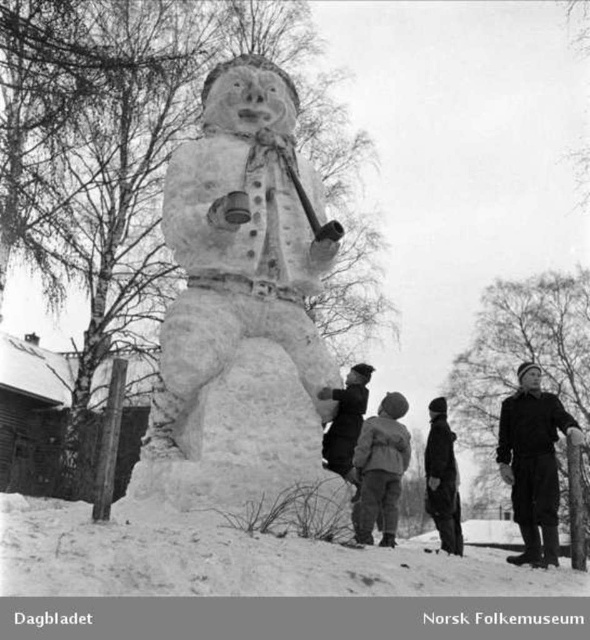
Can you confirm if dark gray woolen hat at upper right is bigger than dark woolen coat at center?

Incorrect, dark gray woolen hat at upper right is not larger than dark woolen coat at center.

In the scene shown: Does dark gray woolen hat at upper right have a lesser height compared to dark woolen coat at center?

Yes.

This screenshot has height=640, width=590. What do you see at coordinates (533, 464) in the screenshot?
I see `dark gray woolen hat at upper right` at bounding box center [533, 464].

Where is `dark gray woolen hat at upper right`? This screenshot has height=640, width=590. dark gray woolen hat at upper right is located at coordinates (533, 464).

Which is above, white snowman at center or dark woolen coat at center?

Positioned higher is white snowman at center.

Between white snowman at center and dark woolen coat at center, which one has less height?

Standing shorter between the two is white snowman at center.

Between point (278, 344) and point (447, 552), which one is positioned behind?

The point (447, 552) is behind.

Locate an element on the screen. white snowman at center is located at coordinates (240, 301).

Can you confirm if light gray woolen jacket at center is taller than dark woolen coat at center?

No, light gray woolen jacket at center is not taller than dark woolen coat at center.

The width and height of the screenshot is (590, 640). What do you see at coordinates (381, 468) in the screenshot?
I see `light gray woolen jacket at center` at bounding box center [381, 468].

This screenshot has width=590, height=640. I want to click on light gray woolen jacket at center, so click(381, 468).